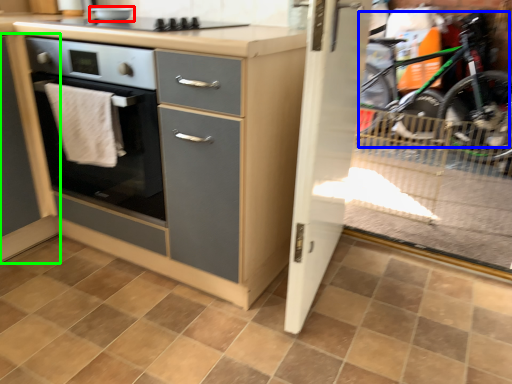
Question: Based on their relative distances, which object is nearer to appliance (highlighted by a red box)? Choose from mountain bike (highlighted by a blue box) and cabinetry (highlighted by a green box).

Choices:
 (A) mountain bike
 (B) cabinetry

Answer: (B)